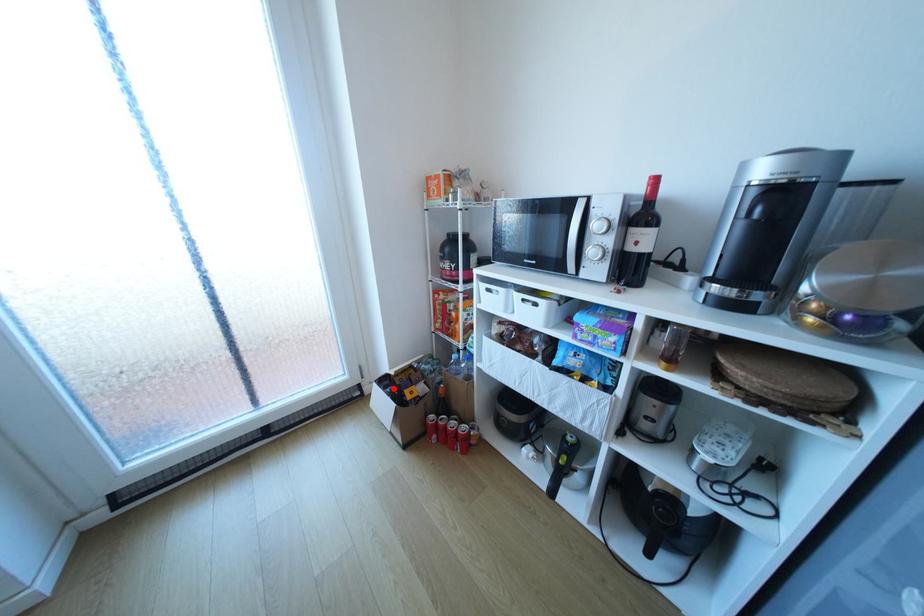
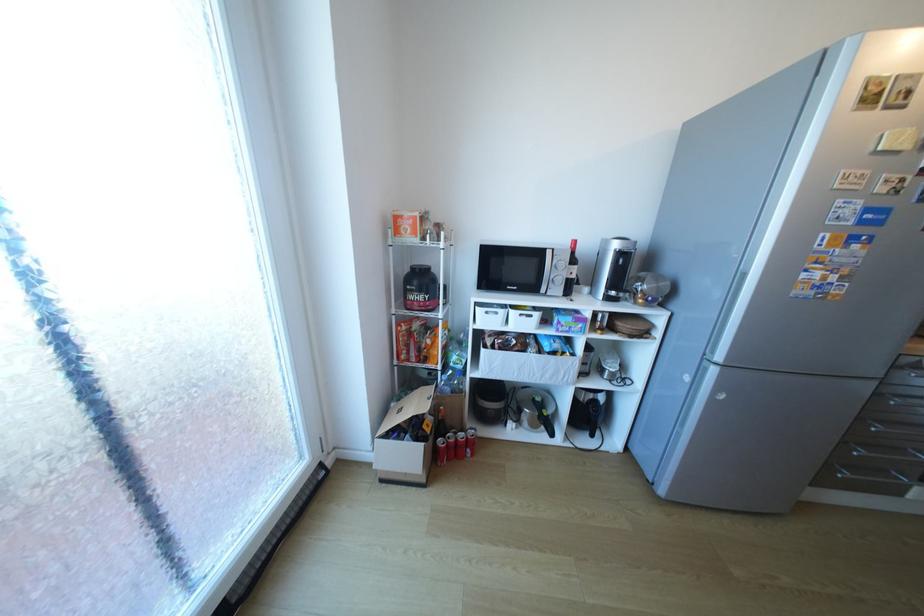
Question: I am providing you with two images of the same scene from different viewpoints. Given a red point in image1, look at the same physical point in image2. Is it:

Choices:
 (A) Closer to the viewpoint
 (B) Farther from the viewpoint

Answer: (B)